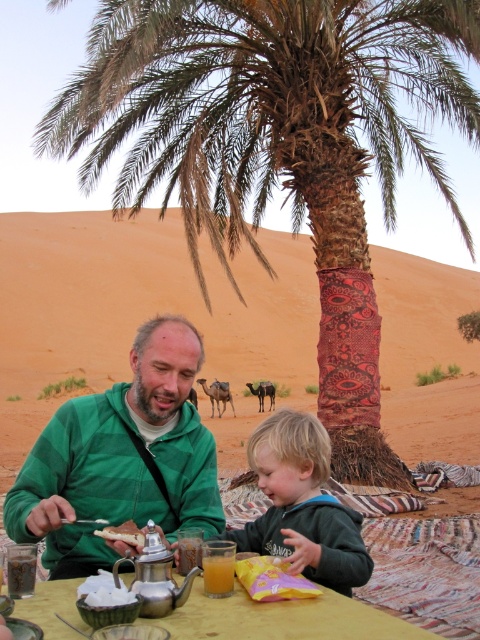
Which is more to the right, brown textured palm tree at center or green fleece jacket at lower center?

brown textured palm tree at center is more to the right.

Is brown textured palm tree at center bigger than green fleece jacket at lower center?

Indeed, brown textured palm tree at center has a larger size compared to green fleece jacket at lower center.

Measure the distance between brown textured palm tree at center and camera.

A distance of 8.35 meters exists between brown textured palm tree at center and camera.

In order to click on brown textured palm tree at center in this screenshot , I will do `click(278, 147)`.

Between point (312, 632) and point (223, 566), which one is positioned behind?

The point (223, 566) is more distant.

Is wooden table at center taller than translucent glass juice at lower center?

Correct, wooden table at center is much taller as translucent glass juice at lower center.

Who is more forward, (69, 602) or (218, 554)?

Positioned in front is point (69, 602).

I want to click on wooden table at center, so click(x=285, y=618).

Between green fleece jacket at center and green fleece jacket at lower center, which one appears on the left side from the viewer's perspective?

Positioned to the left is green fleece jacket at center.

Is green fleece jacket at center above green fleece jacket at lower center?

Indeed, green fleece jacket at center is positioned over green fleece jacket at lower center.

In the scene shown: Who is more distant from viewer, (27, 513) or (243, 538)?

The point (243, 538) is behind.

At what (x,y) coordinates should I click in order to perform the action: click on green fleece jacket at center. Please return your answer as a coordinate pair (x, y). Image resolution: width=480 pixels, height=640 pixels. Looking at the image, I should click on (120, 460).